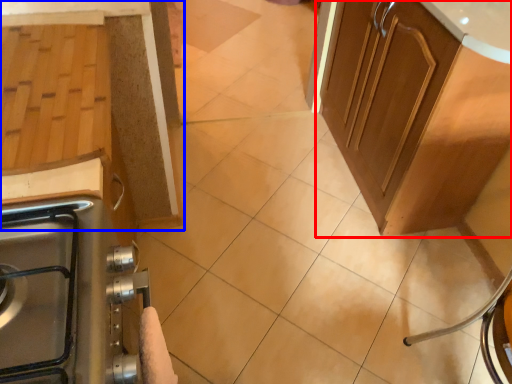
Question: Among these objects, which one is farthest to the camera, cabinetry (highlighted by a red box) or cabinetry (highlighted by a blue box)?

Choices:
 (A) cabinetry
 (B) cabinetry

Answer: (A)